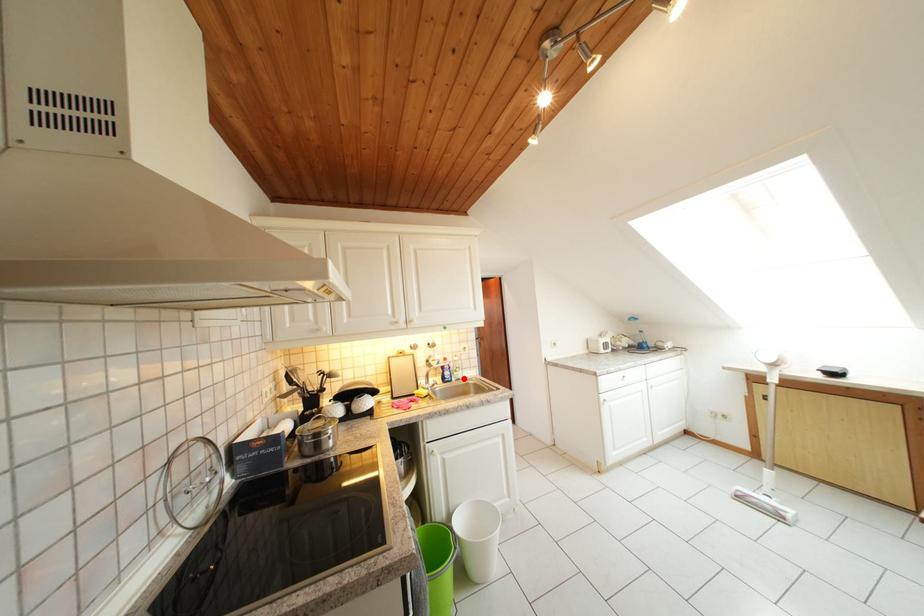
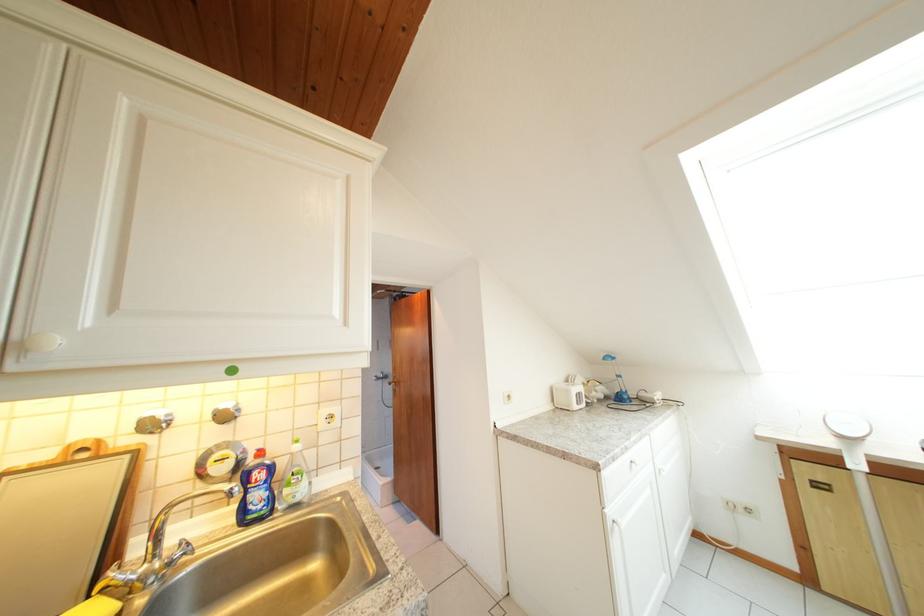
Where in the second image is the point corresponding to the highlighted location from the first image?

(295, 496)